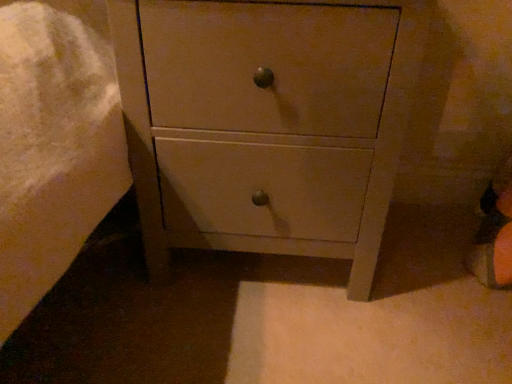
I want to click on matte white chest of drawers at center, so click(266, 123).

The image size is (512, 384). Describe the element at coordinates (266, 123) in the screenshot. I see `matte white chest of drawers at center` at that location.

Locate an element on the screen. This screenshot has width=512, height=384. matte white chest of drawers at center is located at coordinates (266, 123).